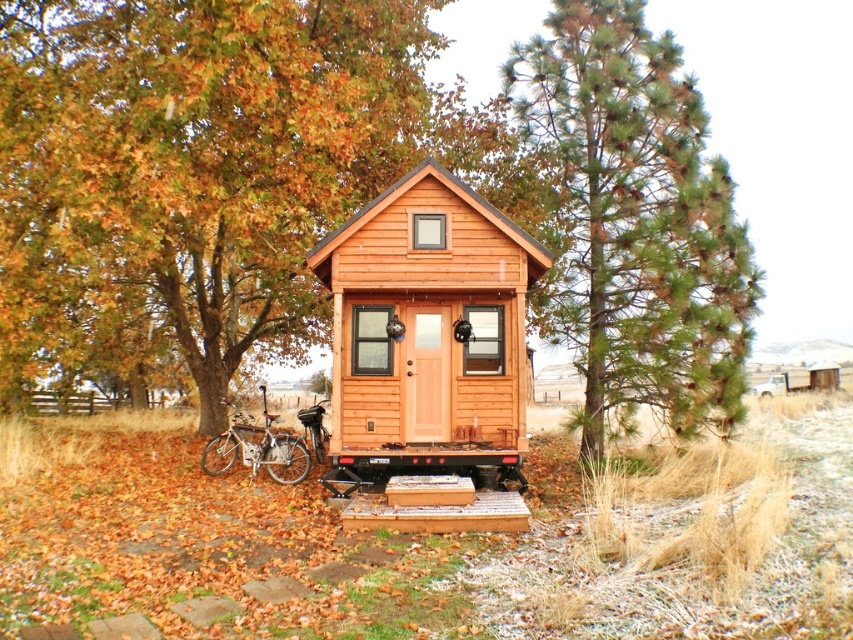
You are standing in front of the cabin and want to take a photo of the green leafy tree at left. Where should you position yourself to capture the tree in the frame?

The green leafy tree at left is located at coordinates point (189, 177), so you should position yourself in front of the cabin facing towards the left side to include the tree in your photo.

You are standing in front of the wooden cabin at center and want to access the wooden platform at center. Which direction should you move to reach it?

The wooden platform at center is in front of the wooden cabin at center, so you should move forward towards the wooden platform at center to reach it.